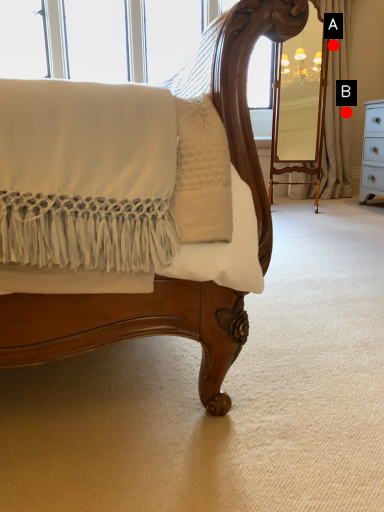
Question: Two points are circled on the image, labeled by A and B beside each circle. Which point is closer to the camera?

Choices:
 (A) A is closer
 (B) B is closer

Answer: (A)